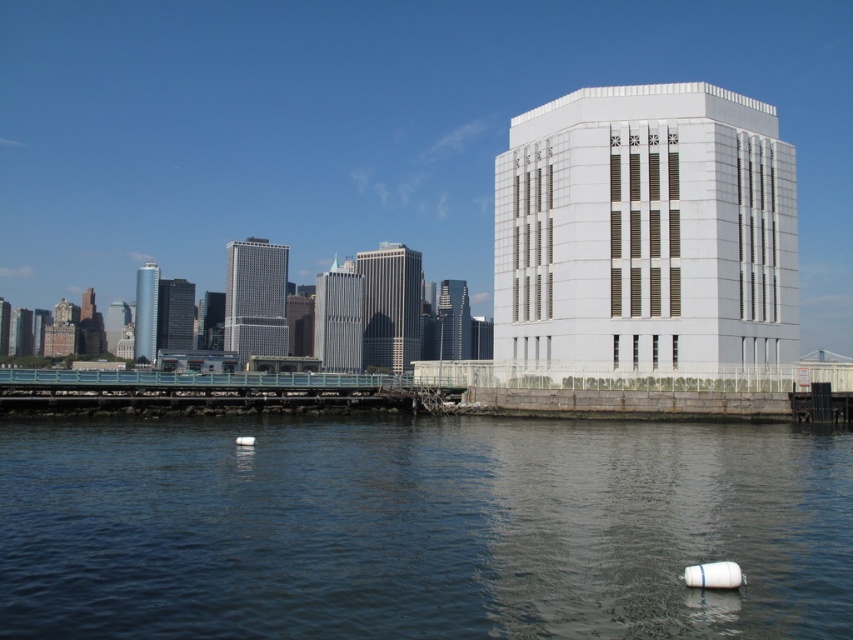
Question: Which of the following is the farthest from the observer?

Choices:
 (A) (604, 120)
 (B) (279, 300)
 (C) (445, 280)

Answer: (C)

Question: Which point appears closest to the camera in this image?

Choices:
 (A) (469, 333)
 (B) (140, 289)
 (C) (270, 257)

Answer: (C)

Question: Does silver reflective skyscraper at center have a smaller size compared to shiny glass skyscraper at center?

Choices:
 (A) yes
 (B) no

Answer: (B)

Question: Does white smooth building at right appear over shiny silver skyscraper at left?

Choices:
 (A) no
 (B) yes

Answer: (A)

Question: Does silver glass skyscraper at center lie in front of black glass tower at center-left?

Choices:
 (A) yes
 (B) no

Answer: (A)

Question: Based on their relative distances, which object is farther from the gray glass skyscraper at center?

Choices:
 (A) black glass tower at center-left
 (B) shiny silver skyscraper at left
 (C) silver reflective skyscraper at center
 (D) clear water at lower center

Answer: (D)